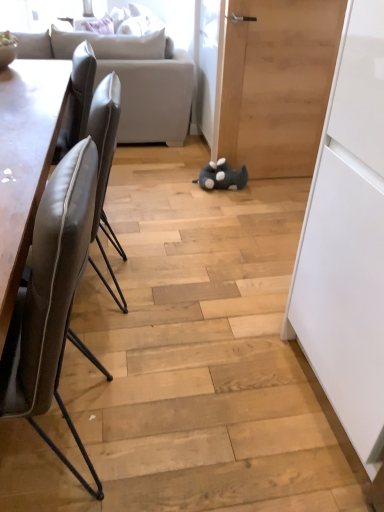
What is the approximate height of leather at left, which is the 2th chair in front-to-back order?

leather at left, which is the 2th chair in front-to-back order, is 35.47 inches tall.

Find the location of a particular element. Image resolution: width=384 pixels, height=512 pixels. gray plush toy at center is located at coordinates (222, 176).

What do you see at coordinates (51, 298) in the screenshot? I see `leather at left, the 1th chair viewed from the front` at bounding box center [51, 298].

You are a GUI agent. You are given a task and a screenshot of the screen. Output one action in this format:
    pyautogui.click(x=<x>, y=<y>)
    Task: Click on the wooden door at center
    The image size is (384, 512).
    Given the screenshot: What is the action you would take?
    pyautogui.click(x=274, y=83)

Locate an element on the screen. Image resolution: width=384 pixels, height=512 pixels. leather at left, which appears as the first chair when viewed from the back is located at coordinates (105, 162).

Is light gray fabric couch at upper left located outside leather at left, which appears as the first chair when viewed from the back?

Yes, light gray fabric couch at upper left is not within leather at left, which appears as the first chair when viewed from the back.

Consider the image. How different are the orientations of light gray fabric couch at upper left and leather at left, which is the 2th chair in front-to-back order, in degrees?

They differ by 0.596 degrees in their facing directions.

Locate an element on the screen. This screenshot has width=384, height=512. studio couch above the leather at left, which is the 2th chair in front-to-back order (from the image's perspective) is located at coordinates (120, 69).

Considering the positions of point (300, 16) and point (134, 130), is point (300, 16) closer or farther from the camera than point (134, 130)?

Point (300, 16) is closer to the camera than point (134, 130).

This screenshot has width=384, height=512. Find the location of `door on the right side of light gray fabric couch at upper left`. door on the right side of light gray fabric couch at upper left is located at coordinates (274, 83).

From a real-world perspective, which object rests below the other?

In real-world perspective, light gray fabric couch at upper left is lower.

From the picture: How distant is wooden door at center from light gray fabric couch at upper left?

85.62 centimeters.

From a real-world perspective, relative to light gray fabric couch at upper left, is leather at left, the 1th chair viewed from the front, vertically above or below?

leather at left, the 1th chair viewed from the front, is situated lower than light gray fabric couch at upper left in the real world.

Is leather at left, which is counted as the second chair, starting from the back, directly adjacent to light gray fabric couch at upper left?

No, leather at left, which is counted as the second chair, starting from the back, is not in contact with light gray fabric couch at upper left.

Does leather at left, which is counted as the second chair, starting from the back, appear on the left side of light gray fabric couch at upper left?

No, leather at left, which is counted as the second chair, starting from the back, is not to the left of light gray fabric couch at upper left.

Which point is more forward, (x=5, y=408) or (x=188, y=82)?

Positioned in front is point (x=5, y=408).

In the scene shown: Is wooden door at center oriented towards leather at left, which appears as the first chair when viewed from the back?

No, wooden door at center is not turned towards leather at left, which appears as the first chair when viewed from the back.

Does wooden door at center have a lesser width compared to leather at left, which is the 2th chair in front-to-back order?

No, wooden door at center is not thinner than leather at left, which is the 2th chair in front-to-back order.

Can you tell me how much wooden door at center and leather at left, which is the 2th chair in front-to-back order, differ in facing direction?

The angle between the facing direction of wooden door at center and the facing direction of leather at left, which is the 2th chair in front-to-back order, is 1.17 degrees.

In the image, is wooden door at center on the left side or the right side of leather at left, which is the 2th chair in front-to-back order?

wooden door at center is to the right of leather at left, which is the 2th chair in front-to-back order.

Which is more to the right, leather at left, which appears as the first chair when viewed from the back, or leather at left, which is counted as the second chair, starting from the back?

From the viewer's perspective, leather at left, which is counted as the second chair, starting from the back, appears more on the right side.

From the image's perspective, between leather at left, which is the 2th chair in front-to-back order, and leather at left, the 1th chair viewed from the front, who is located below?

leather at left, the 1th chair viewed from the front, from the image's perspective.

From a real-world perspective, which is physically above, leather at left, which is the 2th chair in front-to-back order, or leather at left, the 1th chair viewed from the front?

leather at left, which is the 2th chair in front-to-back order, is physically above.

Is gray plush toy at center spatially inside leather at left, which is the 2th chair in front-to-back order, or outside of it?

gray plush toy at center is spatially situated outside leather at left, which is the 2th chair in front-to-back order.

Measure the distance from gray plush toy at center to leather at left, which appears as the first chair when viewed from the back.

gray plush toy at center and leather at left, which appears as the first chair when viewed from the back, are 1.44 meters apart.

Are gray plush toy at center and leather at left, which appears as the first chair when viewed from the back, located far from each other?

gray plush toy at center is positioned a significant distance from leather at left, which appears as the first chair when viewed from the back.

From the image's perspective, is gray plush toy at center located beneath leather at left, which appears as the first chair when viewed from the back?

No.

Consider the image. From a real-world perspective, relative to light gray fabric couch at upper left, is leather at left, which is the 2th chair in front-to-back order, vertically above or below?

leather at left, which is the 2th chair in front-to-back order, is situated lower than light gray fabric couch at upper left in the real world.

Is point (122, 257) closer or farther from the camera than point (193, 127)?

Point (122, 257) is positioned closer to the camera compared to point (193, 127).

Could you tell me if leather at left, which is the 2th chair in front-to-back order, is facing light gray fabric couch at upper left?

No.

Which object is thinner, leather at left, which is the 2th chair in front-to-back order, or light gray fabric couch at upper left?

Thinner between the two is leather at left, which is the 2th chair in front-to-back order.

You are a GUI agent. You are given a task and a screenshot of the screen. Output one action in this format:
    pyautogui.click(x=<x>, y=<y>)
    Task: Click on the studio couch above the leather at left, which appears as the first chair when viewed from the back (from the image's perspective)
    This screenshot has width=384, height=512.
    Given the screenshot: What is the action you would take?
    pyautogui.click(x=120, y=69)

This screenshot has height=512, width=384. Find the location of `door on the right of light gray fabric couch at upper left`. door on the right of light gray fabric couch at upper left is located at coordinates tap(274, 83).

From the image, which object appears to be nearer to leather at left, which appears as the first chair when viewed from the back, light gray fabric couch at upper left or leather at left, which is counted as the second chair, starting from the back?

leather at left, which is counted as the second chair, starting from the back, lies closer to leather at left, which appears as the first chair when viewed from the back, than the other object.

When comparing their distances from gray plush toy at center, does leather at left, which is counted as the second chair, starting from the back, or leather at left, which appears as the first chair when viewed from the back, seem closer?

Based on the image, leather at left, which appears as the first chair when viewed from the back, appears to be nearer to gray plush toy at center.

When comparing their distances from leather at left, the 1th chair viewed from the front, does gray plush toy at center or light gray fabric couch at upper left seem further?

light gray fabric couch at upper left is further to leather at left, the 1th chair viewed from the front.

Which object lies nearer to the anchor point light gray fabric couch at upper left, gray plush toy at center or wooden door at center?

Among the two, wooden door at center is located nearer to light gray fabric couch at upper left.

When comparing their distances from wooden door at center, does gray plush toy at center or leather at left, which is the 2th chair in front-to-back order, seem further?

The object further to wooden door at center is leather at left, which is the 2th chair in front-to-back order.

Looking at the image, which one is located closer to light gray fabric couch at upper left, leather at left, which appears as the first chair when viewed from the back, or leather at left, which is counted as the second chair, starting from the back?

leather at left, which appears as the first chair when viewed from the back, is closer to light gray fabric couch at upper left.

Based on the photo, considering their positions, is wooden door at center positioned further to gray plush toy at center than light gray fabric couch at upper left?

light gray fabric couch at upper left lies further to gray plush toy at center than the other object.

In the scene shown: Considering their positions, is light gray fabric couch at upper left positioned further to wooden door at center than leather at left, the 1th chair viewed from the front?

leather at left, the 1th chair viewed from the front, lies further to wooden door at center than the other object.

Where is `chair between light gray fabric couch at upper left and leather at left, which is counted as the second chair, starting from the back, in the up-down direction`? This screenshot has width=384, height=512. chair between light gray fabric couch at upper left and leather at left, which is counted as the second chair, starting from the back, in the up-down direction is located at coordinates (105, 162).

Identify the location of toy between light gray fabric couch at upper left and leather at left, which is the 2th chair in front-to-back order, in the vertical direction. (222, 176).

Where is `door between leather at left, the 1th chair viewed from the front, and light gray fabric couch at upper left, along the z-axis`? door between leather at left, the 1th chair viewed from the front, and light gray fabric couch at upper left, along the z-axis is located at coordinates (274, 83).

The width and height of the screenshot is (384, 512). Identify the location of toy between light gray fabric couch at upper left and wooden door at center from left to right. (222, 176).